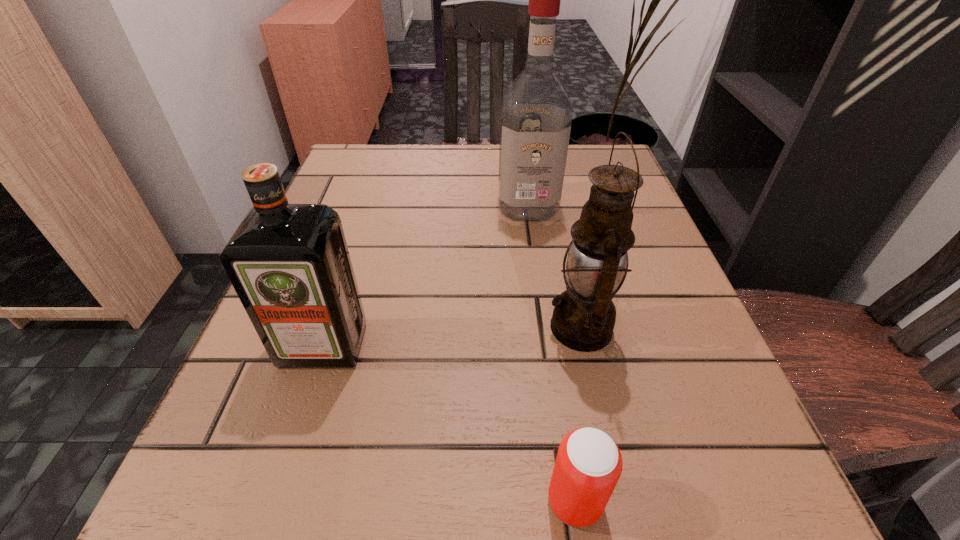
Locate an element on the screen. blank space located on the back of the nearest object is located at coordinates (544, 295).

Find the location of a particular element. The width and height of the screenshot is (960, 540). object that is positioned at the far edge is located at coordinates (536, 115).

Find the location of a particular element. object that is at the near edge is located at coordinates (588, 465).

Identify the location of object that is at the left edge. This screenshot has width=960, height=540. (289, 264).

Where is `object at the right edge`? The image size is (960, 540). object at the right edge is located at coordinates (583, 319).

In the image, there is a desktop. Identify the location of free region at the far edge. The height and width of the screenshot is (540, 960). (477, 151).

What are the coordinates of `free space at the near edge of the desktop` in the screenshot? It's located at (519, 539).

Identify the location of vacant point at the left edge. This screenshot has width=960, height=540. (339, 203).

In the image, there is a desktop. Identify the location of vacant region at the right edge. (680, 308).

The width and height of the screenshot is (960, 540). In the image, there is a desktop. In order to click on vacant space at the far left corner in this screenshot , I will do `click(370, 163)`.